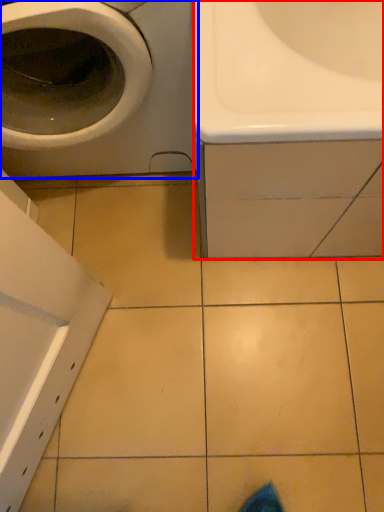
Question: Among these objects, which one is farthest to the camera, sink (highlighted by a red box) or washing machine (highlighted by a blue box)?

Choices:
 (A) sink
 (B) washing machine

Answer: (A)